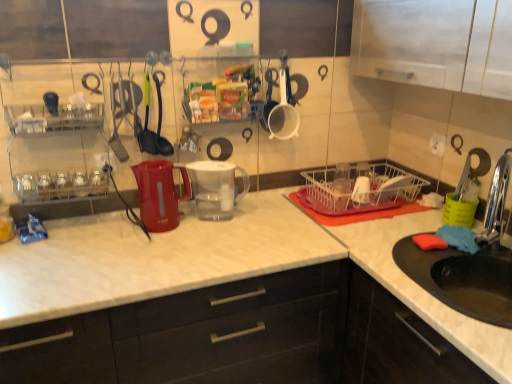
Identify the location of free area in between matte plastic kettle at center, acting as the 1th appliance starting from the left, and chrome metallic faucet at sink right. The image size is (512, 384). (297, 234).